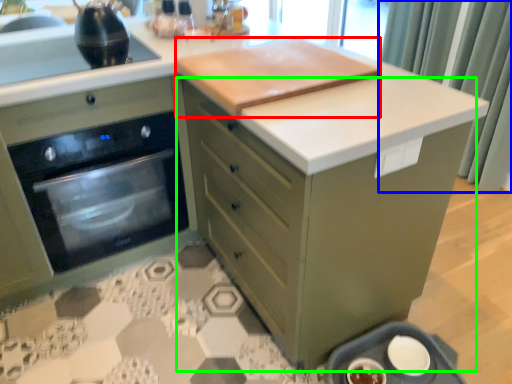
Question: Which object is the farthest from wide (highlighted by a red box)? Choose among these: curtain (highlighted by a blue box) or cabinetry (highlighted by a green box).

Choices:
 (A) curtain
 (B) cabinetry

Answer: (A)